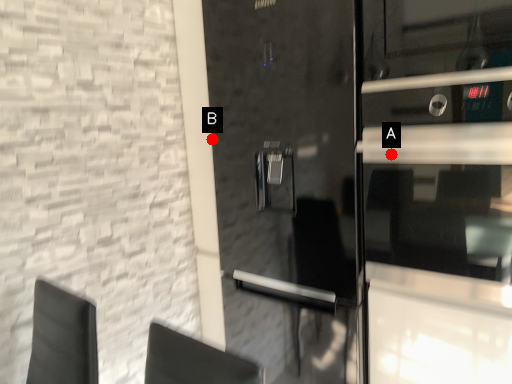
Question: Two points are circled on the image, labeled by A and B beside each circle. Which point is closer to the camera?

Choices:
 (A) A is closer
 (B) B is closer

Answer: (A)